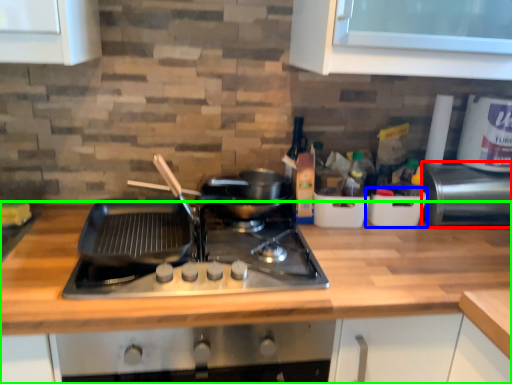
Question: Which is farther away from appliance (highlighted by a red box)? appliance (highlighted by a blue box) or countertop (highlighted by a green box)?

Choices:
 (A) appliance
 (B) countertop

Answer: (B)